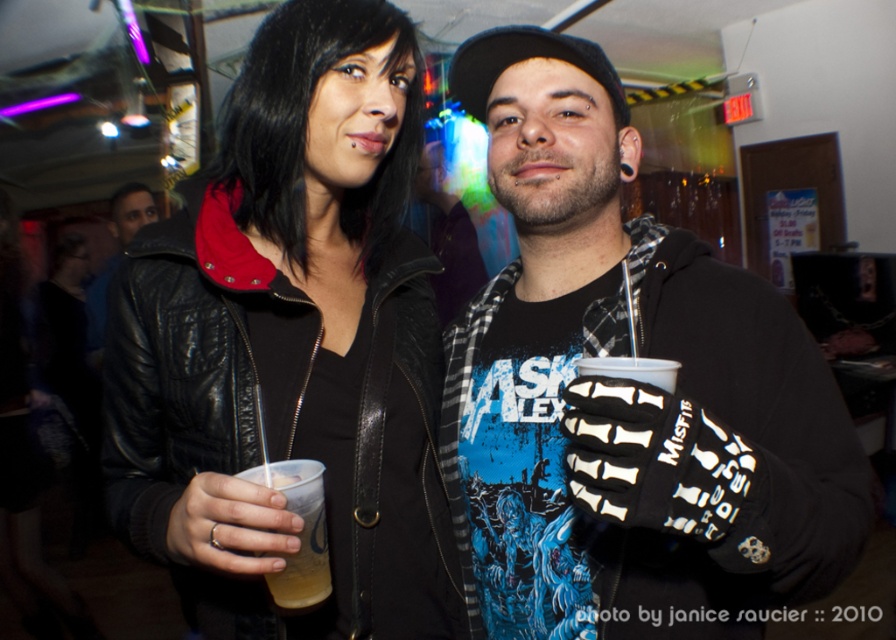
Question: Among these objects, which one is nearest to the camera?

Choices:
 (A) black matte glove at center
 (B) translucent plastic cup at center
 (C) matte black leather jacket at center

Answer: (A)

Question: Based on their relative distances, which object is farther from the matte black leather jacket at center?

Choices:
 (A) black matte glove at center
 (B) translucent plastic cup at center

Answer: (B)

Question: Where is matte black leather jacket at center located in relation to translucent plastic cup at center in the image?

Choices:
 (A) left
 (B) right

Answer: (A)

Question: Which of these objects is positioned closest to the matte black leather jacket at center?

Choices:
 (A) translucent plastic cup at center
 (B) black matte glove at center

Answer: (B)

Question: From the image, what is the correct spatial relationship of black matte glove at center in relation to translucent plastic cup at center?

Choices:
 (A) below
 (B) above

Answer: (B)

Question: Can you confirm if matte black leather jacket at center is positioned to the left of translucent plastic cup at center?

Choices:
 (A) yes
 (B) no

Answer: (A)